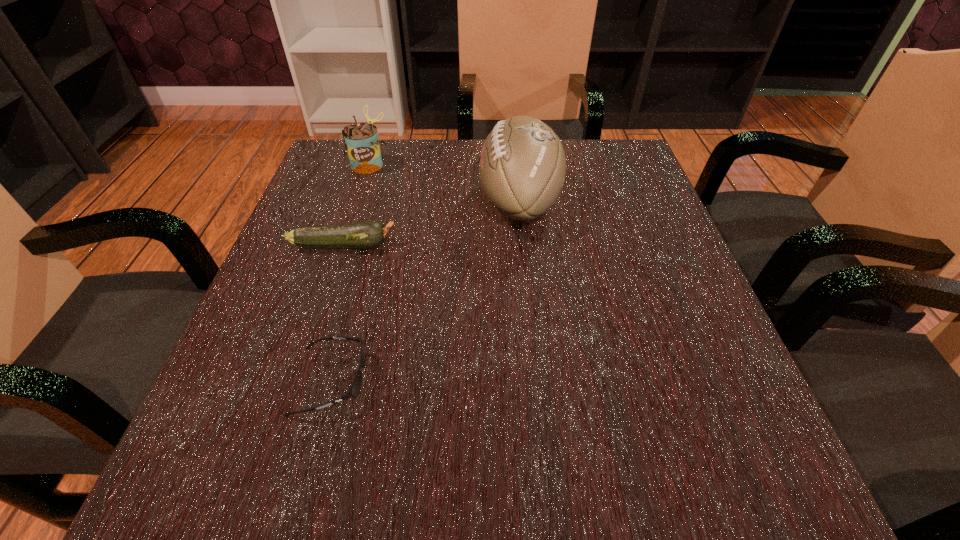
Identify the location of the tallest object. The width and height of the screenshot is (960, 540). (522, 165).

This screenshot has height=540, width=960. In order to click on the rightmost object in this screenshot , I will do `click(522, 165)`.

Image resolution: width=960 pixels, height=540 pixels. In order to click on the third shortest object in this screenshot , I will do `click(361, 141)`.

At what (x,y) coordinates should I click in order to perform the action: click on the third tallest object. Please return your answer as a coordinate pair (x, y). Looking at the image, I should click on (368, 234).

In order to click on the shortest object in this screenshot , I will do `click(355, 388)`.

Find the location of `the nearest object`. the nearest object is located at coordinates (355, 388).

Locate an element on the screen. Image resolution: width=960 pixels, height=540 pixels. vacant space positioned 0.080m on the laces of the football (American) is located at coordinates (441, 201).

What are the coordinates of `vacant space positioned 0.240m on the laces of the football (American)` in the screenshot? It's located at (367, 201).

Find the location of a particular element. The height and width of the screenshot is (540, 960). blank space located 0.210m on the laces of the football (American) is located at coordinates (380, 201).

This screenshot has width=960, height=540. What are the coordinates of `vacant space located on the right of the can` in the screenshot? It's located at (555, 164).